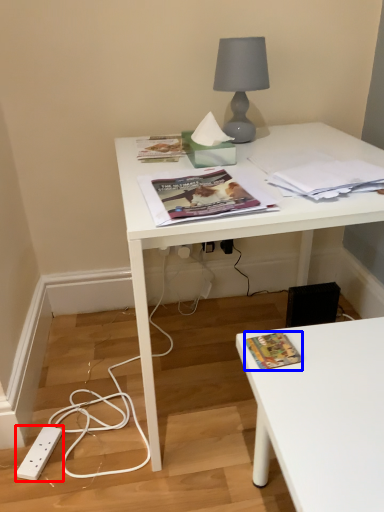
Question: Which object appears closest to the camera in this image, power plugs and sockets (highlighted by a red box) or book cover (highlighted by a blue box)?

Choices:
 (A) power plugs and sockets
 (B) book cover

Answer: (B)